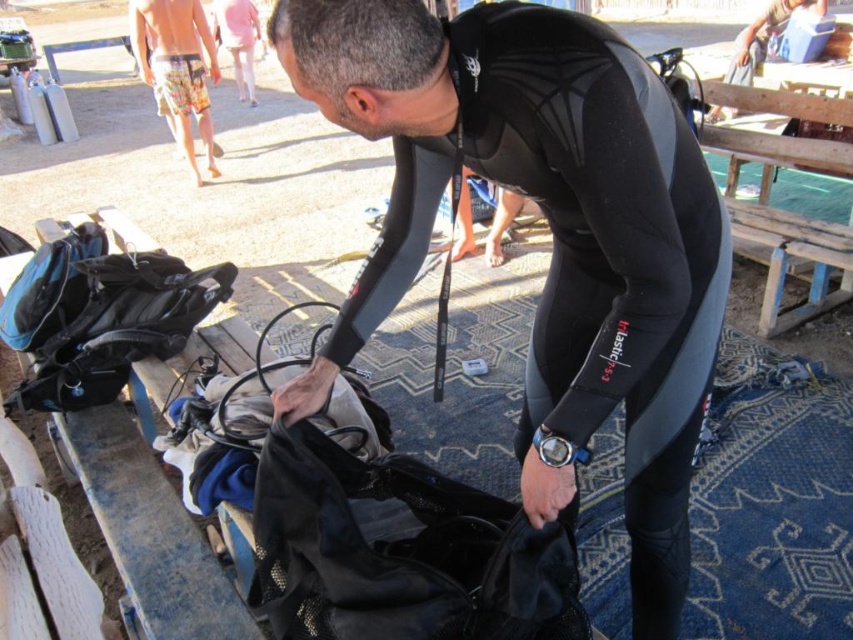
Question: Which is farther from the black neoprene wetsuit at center?

Choices:
 (A) multicolored board shorts at upper left
 (B) black mesh bag at center

Answer: (A)

Question: Among these points, which one is farthest from the camera?

Choices:
 (A) (225, 38)
 (B) (566, 371)
 (C) (262, 465)
 (D) (207, 140)

Answer: (A)

Question: Where is multicolored board shorts at upper left located in relation to pink fabric pants at upper center in the image?

Choices:
 (A) right
 (B) left

Answer: (A)

Question: Based on their relative distances, which object is nearer to the multicolored board shorts at upper left?

Choices:
 (A) pink fabric pants at upper center
 (B) black neoprene wetsuit at center

Answer: (A)

Question: Is multicolored board shorts at upper left closer to the viewer compared to pink fabric pants at upper center?

Choices:
 (A) yes
 (B) no

Answer: (A)

Question: Can you confirm if black neoprene wetsuit at center is bigger than black mesh bag at center?

Choices:
 (A) yes
 (B) no

Answer: (A)